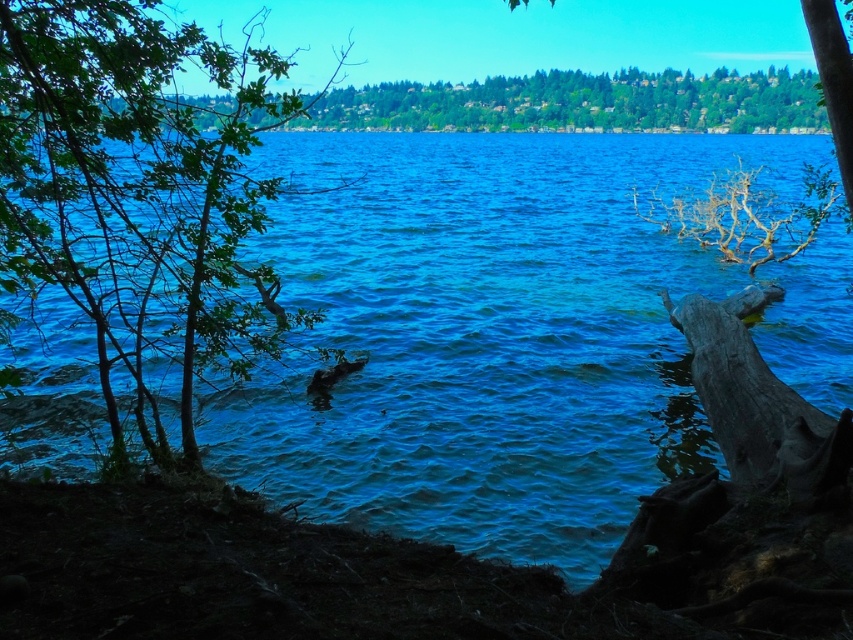
Question: Is blue water at center smaller than green leafy tree at left?

Choices:
 (A) yes
 (B) no

Answer: (A)

Question: Is green leafy tree at left positioned at the back of green leafy tree at upper center?

Choices:
 (A) no
 (B) yes

Answer: (A)

Question: Which object is the closest to the green leafy tree at left?

Choices:
 (A) green leafy tree at upper center
 (B) blue water at center

Answer: (B)

Question: Among these objects, which one is nearest to the camera?

Choices:
 (A) green leafy tree at left
 (B) blue water at center

Answer: (A)

Question: Does blue water at center lie behind green leafy tree at left?

Choices:
 (A) yes
 (B) no

Answer: (A)

Question: Which point appears farthest from the camera in this image?

Choices:
 (A) (699, 83)
 (B) (376, 349)

Answer: (A)